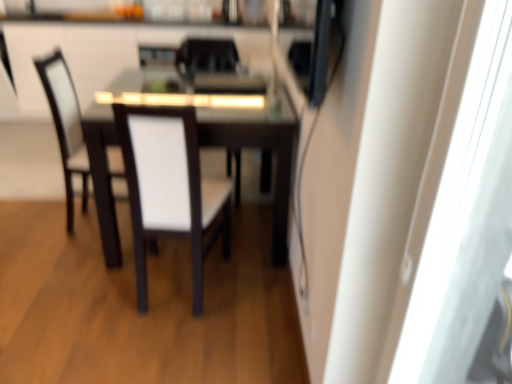
At what (x,y) coordinates should I click in order to perform the action: click on free location to the right of white fabric chair at center, which is the 1th chair from front to back. Please return your answer as a coordinate pair (x, y). This screenshot has width=512, height=384. Looking at the image, I should click on (255, 297).